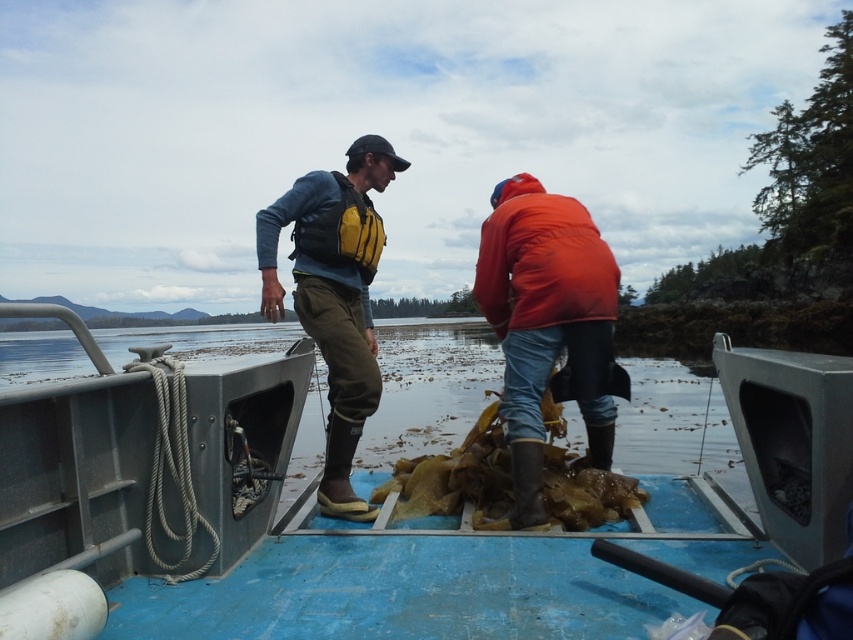
Looking at this image, you are a marine biologist observing the scene. You need to determine the relative widths of the metallic blue boat at center and the clear water at center. Based on the scene, which one is narrower?

The metallic blue boat at center is narrower than the clear water at center, as stated in the description.

You are standing on the boat and want to pick up an item located at point (354,467) and another item at point (589,216). Which point is closer to you?

Point (354,467) is further to the camera than point (589,216), so the point closer to you is point (589,216).

You are standing on the boat and need to move from the point at coordinates point (x=282, y=436) to the point at coordinates point (x=71, y=344). Which direction should you move relative to the boat?

You should move backward because point (x=282, y=436) is in front of point (x=71, y=344), so moving backward from point (x=282, y=436) will take you towards point (x=71, y=344).